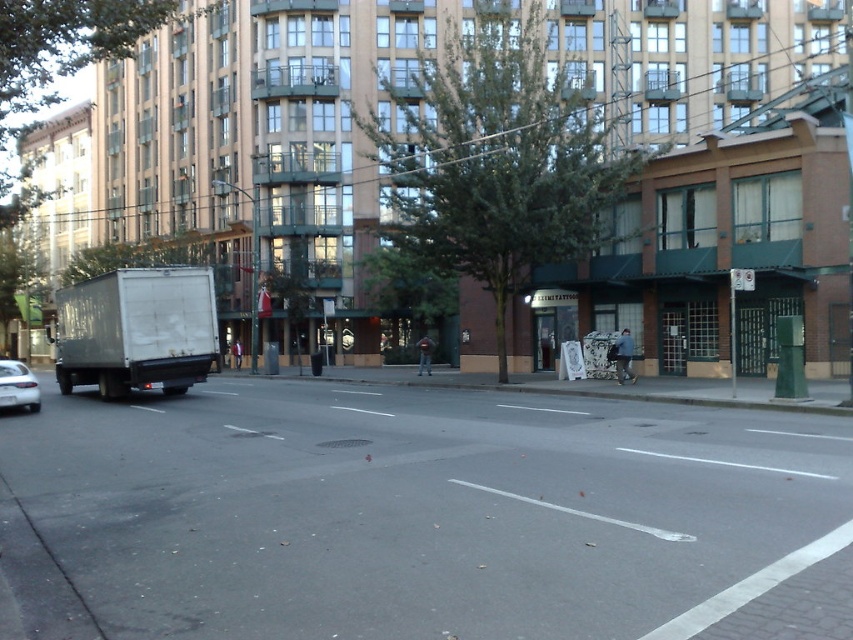
Question: Which point is farther to the camera?

Choices:
 (A) (84, 284)
 (B) (19, 397)

Answer: (A)

Question: Is white matte truck at left smaller than white matte sedan at lower left?

Choices:
 (A) no
 (B) yes

Answer: (A)

Question: Which object appears closest to the camera in this image?

Choices:
 (A) white matte sedan at lower left
 (B) white matte truck at left

Answer: (A)

Question: In this image, where is white matte truck at left located relative to white matte sedan at lower left?

Choices:
 (A) above
 (B) below

Answer: (A)

Question: Can you confirm if white matte truck at left is bigger than white matte sedan at lower left?

Choices:
 (A) no
 (B) yes

Answer: (B)